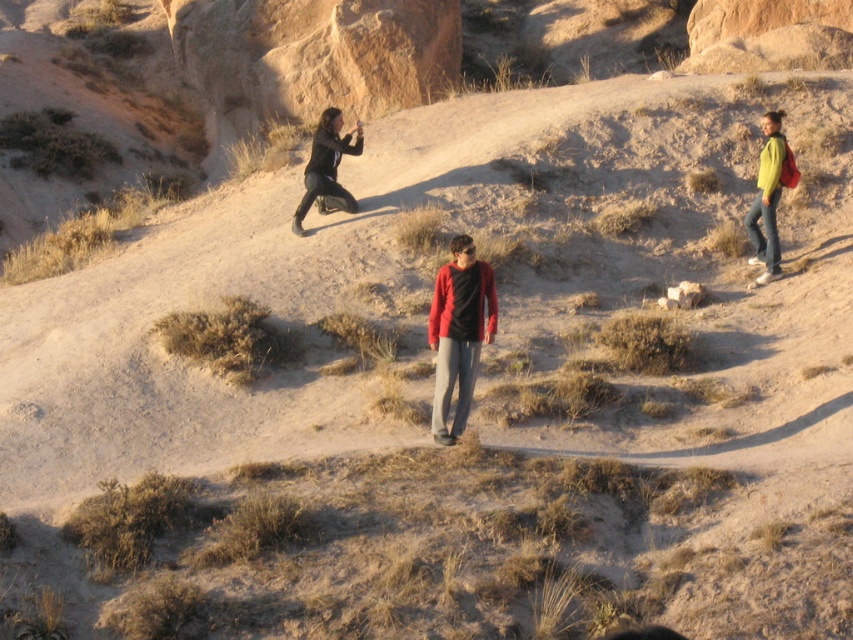
Is matte red sweater at center positioned before green matte jacket at right?

Yes, it is in front of green matte jacket at right.

What do you see at coordinates (459, 332) in the screenshot?
I see `matte red sweater at center` at bounding box center [459, 332].

Does point (457, 241) come in front of point (758, 214)?

That is True.

In order to click on matte red sweater at center in this screenshot , I will do `click(459, 332)`.

Which is above, matte red sweater at center or matte black jacket at upper center?

matte black jacket at upper center is above.

Is the position of matte red sweater at center more distant than that of matte black jacket at upper center?

No, it is in front of matte black jacket at upper center.

Identify the location of matte red sweater at center. (459, 332).

Is matte black jacket at upper center to the right of green matte jacket at right from the viewer's perspective?

No, matte black jacket at upper center is not to the right of green matte jacket at right.

Who is more distant from viewer, (358, 136) or (763, 150)?

The point (358, 136) is more distant.

Which is behind, point (314, 170) or point (772, 260)?

The point (314, 170) is behind.

Find the location of a particular element. The width and height of the screenshot is (853, 640). matte black jacket at upper center is located at coordinates (328, 168).